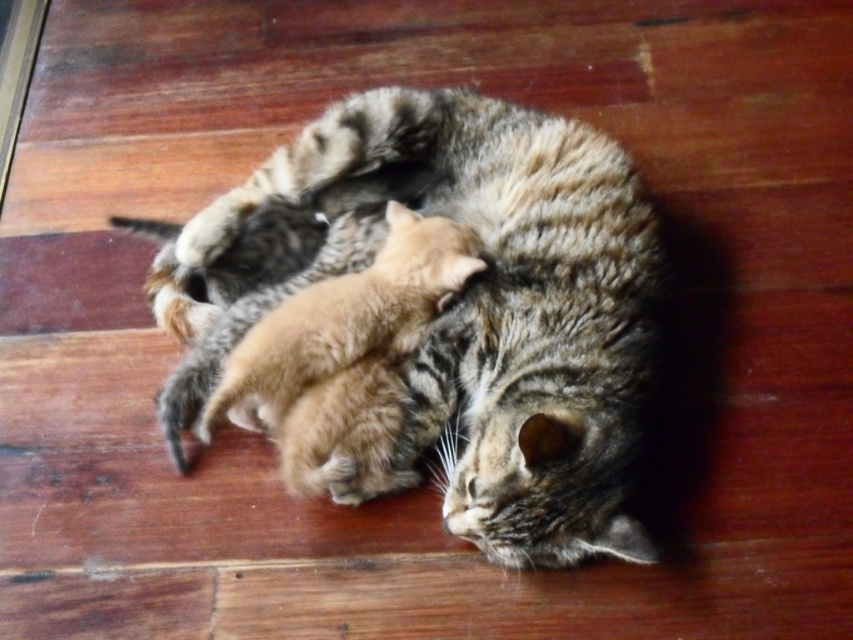
Does tabby fur cat at center appear under orange fur kitten at center?

No, tabby fur cat at center is not below orange fur kitten at center.

Can you confirm if tabby fur cat at center is taller than orange fur kitten at center?

Correct, tabby fur cat at center is much taller as orange fur kitten at center.

Describe the element at coordinates (503, 305) in the screenshot. The height and width of the screenshot is (640, 853). I see `tabby fur cat at center` at that location.

You are a GUI agent. You are given a task and a screenshot of the screen. Output one action in this format:
    pyautogui.click(x=<x>, y=<y>)
    Task: Click on the tabby fur cat at center
    This screenshot has width=853, height=640.
    Given the screenshot: What is the action you would take?
    pos(503,305)